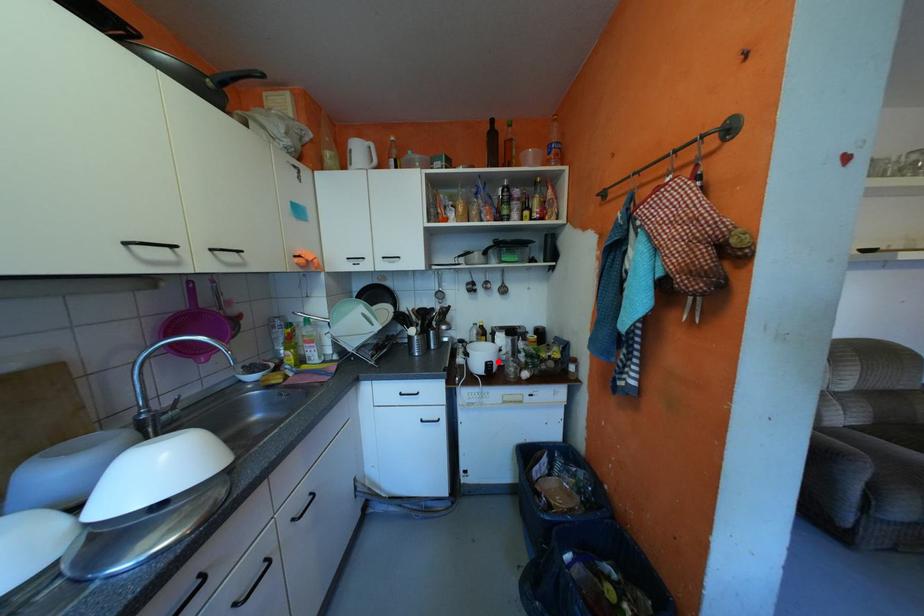
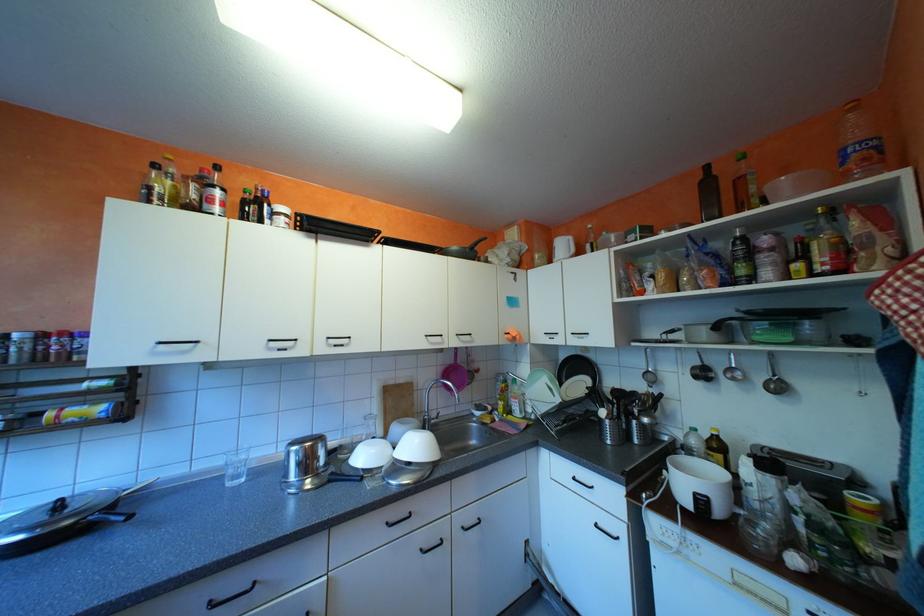
Locate, in the second image, the point that corresponds to the highlighted location in the first image.

(708, 493)